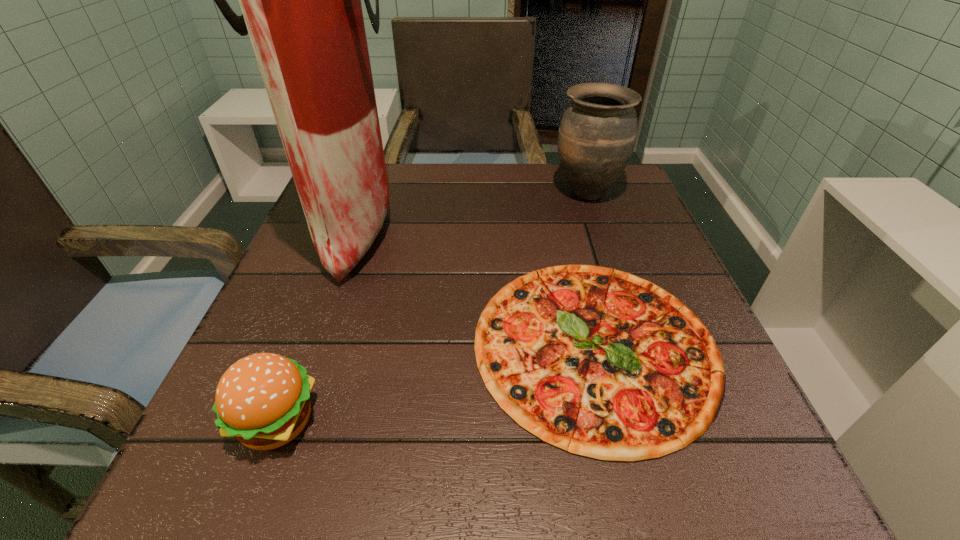
Where is `vacant area that lies between the tallest object and the third tallest object`? The height and width of the screenshot is (540, 960). vacant area that lies between the tallest object and the third tallest object is located at coordinates [317, 324].

Identify the location of unoccupied area between the hamburger and the tallest object. (317, 324).

Find the location of `free space between the pizza and the grocery bag`. free space between the pizza and the grocery bag is located at coordinates (475, 287).

You are a GUI agent. You are given a task and a screenshot of the screen. Output one action in this format:
    pyautogui.click(x=<x>, y=<y>)
    Task: Click on the vacant area that lies between the pizza and the hamburger
    
    Given the screenshot: What is the action you would take?
    pyautogui.click(x=437, y=382)

Identify which object is located as the second nearest to the shortest object. Please provide its 2D coordinates. Your answer should be formatted as a tuple, i.e. [(x, y)], where the tuple contains the x and y coordinates of a point satisfying the conditions above.

[(597, 134)]

The image size is (960, 540). I want to click on object that is the closest to the pizza, so click(301, 0).